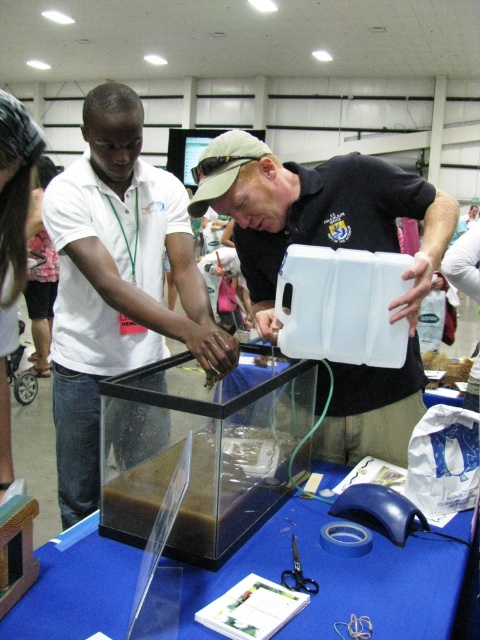
You are a participant at the event and need to place a 15cm tall object on either the white matte container at center or the blue plastic table at center. Which surface can safely accommodate the object without it exceeding the height of the surface?

The white matte container at center is taller than the blue plastic table at center, so placing the 15cm tall object on the white matte container at center would be safer as it is taller and less likely to exceed its height. However, if the container itself is not stable, the table might be a better option for stability despite its shorter height. But based on height alone, the container is suitable.

You are a participant at the event and need to place a small object into the white matte container at center. Which object should you avoid placing there to prevent it from falling onto the blue plastic table at center?

You should avoid placing any object that is heavier or larger than the white matte container at center can hold, as it is positioned over the blue plastic table at center and might not be stable enough to support heavy items.

Consider the image. You are standing at the entrance of the event and want to locate the white shirt at center. According to the coordinates provided, in which direction should you look relative to the center of the image?

The white shirt at center is located at coordinates point (117, 282), which is slightly to the right and below the center of the image.